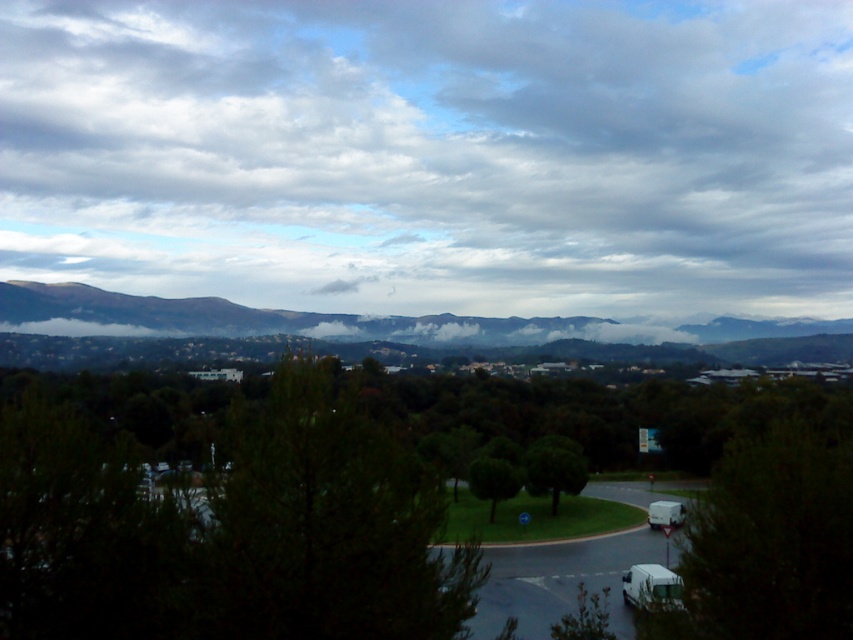
Question: Can you confirm if green mossy hillside at center is positioned to the right of green leafy tree at center?

Choices:
 (A) no
 (B) yes

Answer: (A)

Question: Can you confirm if green matte tree at center is positioned to the right of green mossy hillside at center?

Choices:
 (A) no
 (B) yes

Answer: (A)

Question: Estimate the real-world distances between objects in this image. Which object is farther from the cloudy sky at upper center?

Choices:
 (A) green leafy tree at center
 (B) green mossy hillside at center

Answer: (A)

Question: Which object is the closest to the green mossy hillside at center?

Choices:
 (A) cloudy sky at upper center
 (B) green leafy tree at center
 (C) green matte tree at center

Answer: (A)

Question: Which point appears closest to the camera in this image?

Choices:
 (A) (415, 125)
 (B) (535, 477)
 (C) (225, 566)
 (D) (433, 348)

Answer: (C)

Question: Is green matte tree at center in front of green leafy tree at center?

Choices:
 (A) no
 (B) yes

Answer: (B)